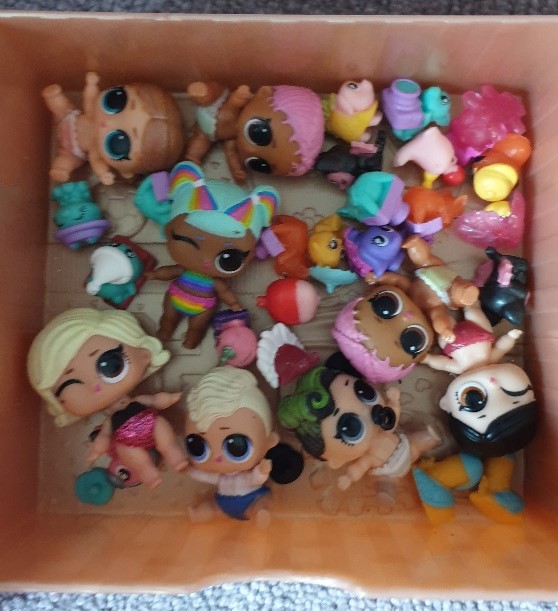
Locate an element on the screen. The width and height of the screenshot is (558, 611). dolls is located at coordinates (84, 370), (228, 404), (346, 404), (519, 400), (399, 340), (134, 109), (285, 118), (209, 246).